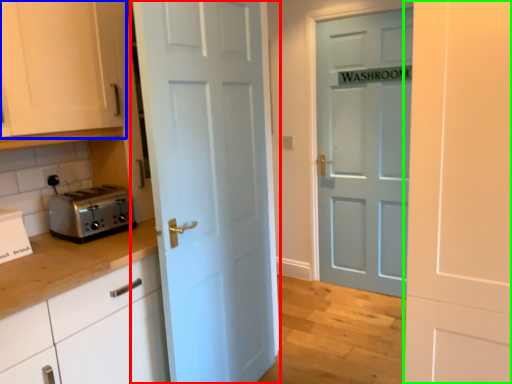
Question: Considering the real-world distances, which object is closest to door (highlighted by a red box)? cabinetry (highlighted by a blue box) or door (highlighted by a green box).

Choices:
 (A) cabinetry
 (B) door

Answer: (A)